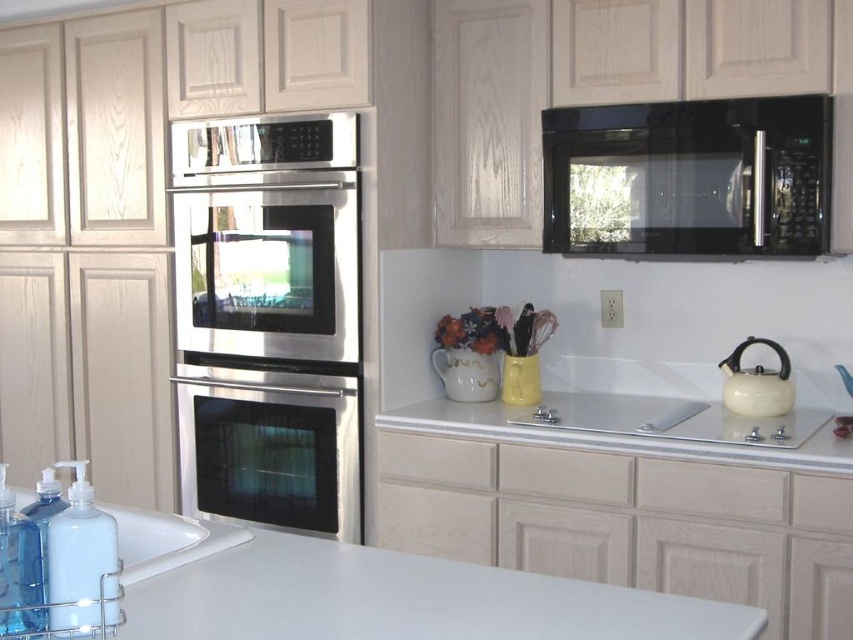
Question: Is white ceramic sink at lower left smaller than white matte tea kettle at right?

Choices:
 (A) yes
 (B) no

Answer: (B)

Question: Is white ceramic sink at lower left to the left of transparent plastic bottle at lower left from the viewer's perspective?

Choices:
 (A) no
 (B) yes

Answer: (B)

Question: Which point is farther to the camera?

Choices:
 (A) stainless steel oven at center
 (B) transparent plastic bottle at lower left
 (C) satin black oven at center
 (D) black glass microwave at upper right

Answer: (C)

Question: Among these points, which one is farthest from the camera?

Choices:
 (A) (350, 579)
 (B) (61, 536)
 (C) (753, 365)

Answer: (C)

Question: Which object is positioned closest to the white matte tea kettle at right?

Choices:
 (A) white glossy counter top at center
 (B) white ceramic sink at lower left
 (C) white matte countertop at center
 (D) stainless steel oven at center

Answer: (A)

Question: From the image, what is the correct spatial relationship of stainless steel oven at center in relation to white matte tea kettle at right?

Choices:
 (A) above
 (B) below

Answer: (A)